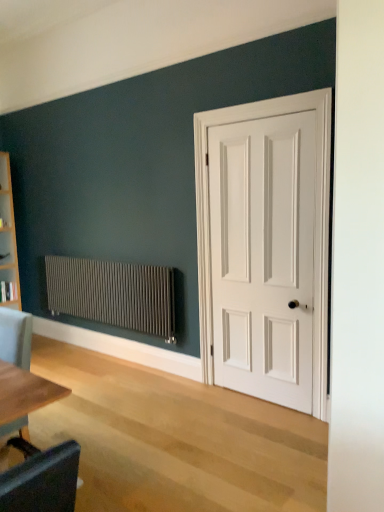
Question: Is matte gray radiator at left not inside white matte door at right?

Choices:
 (A) no
 (B) yes

Answer: (B)

Question: Can you confirm if matte gray radiator at left is wider than white matte door at right?

Choices:
 (A) yes
 (B) no

Answer: (A)

Question: From a real-world perspective, is matte gray radiator at left physically above white matte door at right?

Choices:
 (A) yes
 (B) no

Answer: (B)

Question: Can you confirm if matte gray radiator at left is shorter than white matte door at right?

Choices:
 (A) no
 (B) yes

Answer: (B)

Question: Considering the relative positions of matte gray radiator at left and white matte door at right in the image provided, is matte gray radiator at left to the right of white matte door at right from the viewer's perspective?

Choices:
 (A) yes
 (B) no

Answer: (B)

Question: Does matte gray radiator at left have a larger size compared to white matte door at right?

Choices:
 (A) no
 (B) yes

Answer: (B)

Question: Considering the relative sizes of light gray fabric chair at lower left and matte gray radiator at left in the image provided, is light gray fabric chair at lower left thinner than matte gray radiator at left?

Choices:
 (A) no
 (B) yes

Answer: (A)

Question: Considering the relative positions of light gray fabric chair at lower left and matte gray radiator at left in the image provided, is light gray fabric chair at lower left to the left of matte gray radiator at left from the viewer's perspective?

Choices:
 (A) yes
 (B) no

Answer: (A)

Question: From the image's perspective, is light gray fabric chair at lower left over matte gray radiator at left?

Choices:
 (A) yes
 (B) no

Answer: (B)

Question: Does light gray fabric chair at lower left have a lesser height compared to matte gray radiator at left?

Choices:
 (A) no
 (B) yes

Answer: (A)

Question: Is light gray fabric chair at lower left placed right next to matte gray radiator at left?

Choices:
 (A) yes
 (B) no

Answer: (B)

Question: Considering the relative sizes of light gray fabric chair at lower left and matte gray radiator at left in the image provided, is light gray fabric chair at lower left taller than matte gray radiator at left?

Choices:
 (A) no
 (B) yes

Answer: (B)

Question: Is matte gray radiator at left closer to the viewer compared to light gray fabric chair at lower left?

Choices:
 (A) yes
 (B) no

Answer: (B)